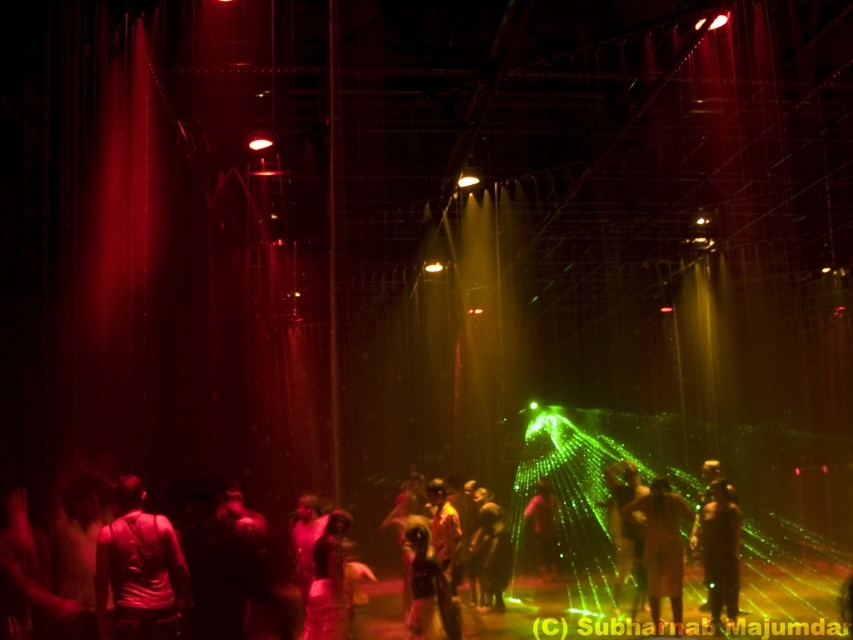
You are a photographer at the event and want to capture a photo where the dark matte clothing at center is visible above the pink fabric person at center. Based on the scene description, is this possible?

Yes, because the dark matte clothing at center is located above the pink fabric person at center according to the description.